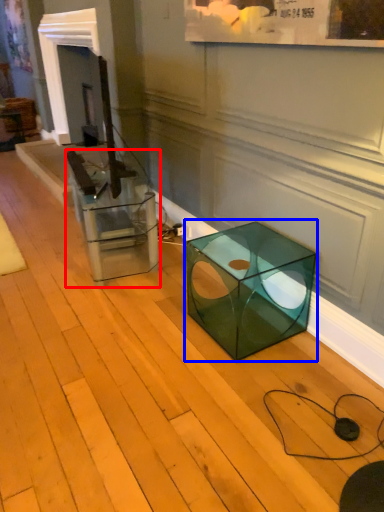
Question: Among these objects, which one is nearest to the camera, glass box (highlighted by a red box) or table (highlighted by a blue box)?

Choices:
 (A) glass box
 (B) table

Answer: (B)